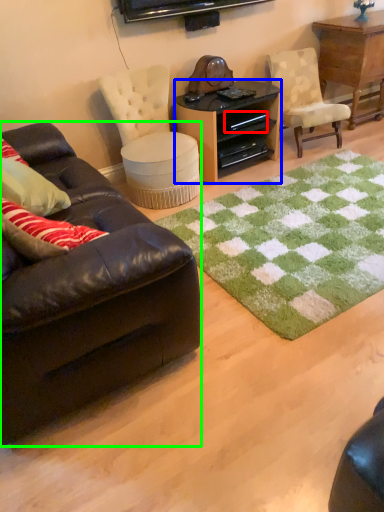
Question: Considering the real-world distances, which object is farthest from drawer (highlighted by a red box)? desk (highlighted by a blue box) or studio couch (highlighted by a green box)?

Choices:
 (A) desk
 (B) studio couch

Answer: (B)